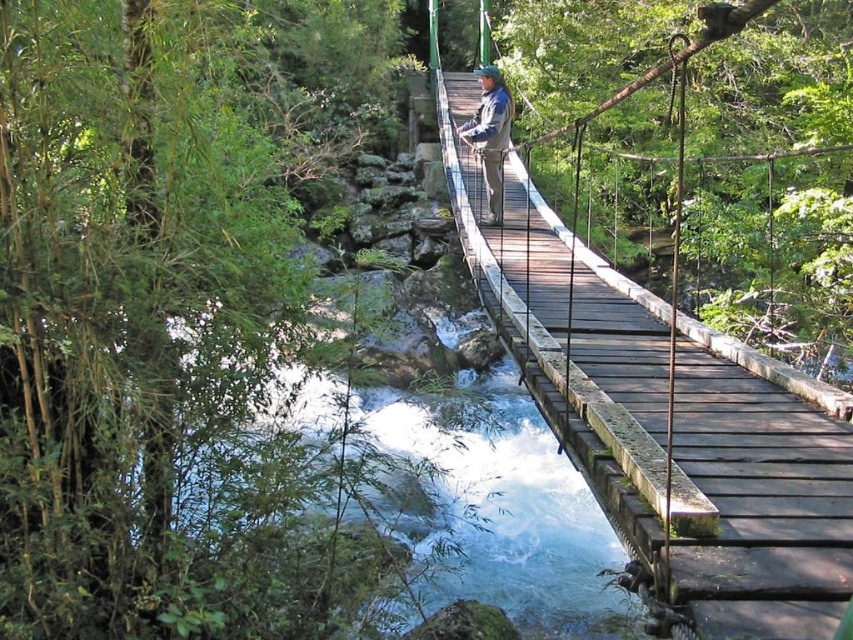
Question: Observing the image, what is the correct spatial positioning of wooden bridge at center in reference to blue denim jacket at center?

Choices:
 (A) right
 (B) left

Answer: (B)

Question: Does wooden bridge at center have a lesser width compared to blue denim jacket at center?

Choices:
 (A) yes
 (B) no

Answer: (B)

Question: Which point is farther from the camera taking this photo?

Choices:
 (A) (753, 401)
 (B) (463, 129)

Answer: (B)

Question: Is wooden bridge at center positioned behind blue denim jacket at center?

Choices:
 (A) no
 (B) yes

Answer: (A)